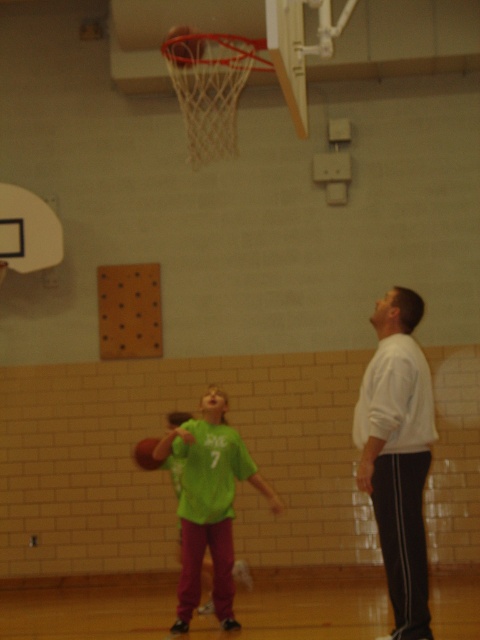
You are standing at the camera position and want to throw a ball to the white smooth shirt at right. Can you estimate how far you need to throw the ball?

The distance between the white smooth shirt at right and the camera is 9.58 meters, so you need to throw the ball approximately 9.58 meters to reach them.

Please look at the basketball court. There is a point marked at coordinates (183, 45). What object is located at that point?

The point at coordinates (183, 45) marks the location of the rubber textured basketball at center.